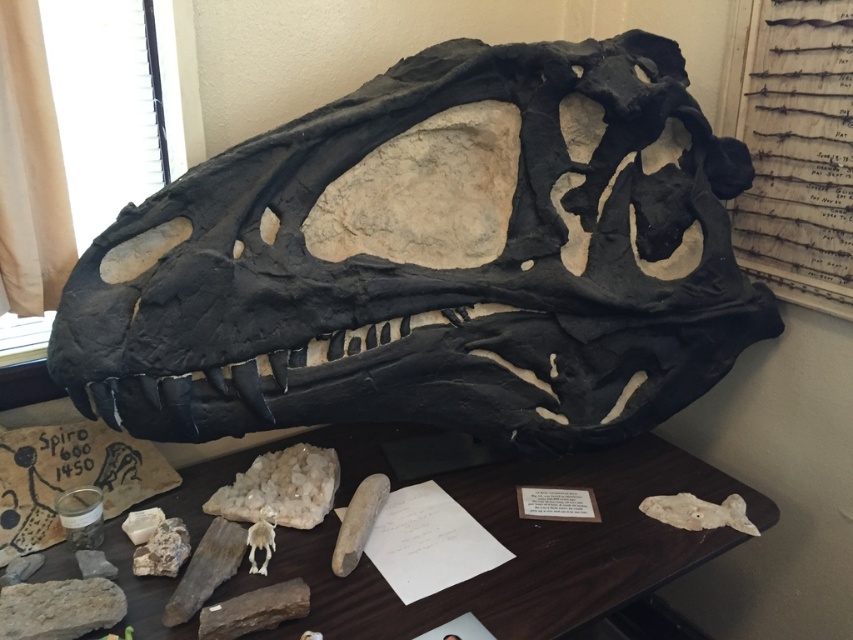
You are a paleontologist examining the smooth wooden table at center and the white bone at center in the image. Which object is located to the right of the other?

The smooth wooden table at center is positioned on the right side of white bone at center, so the smooth wooden table at center is to the right of the white bone at center.